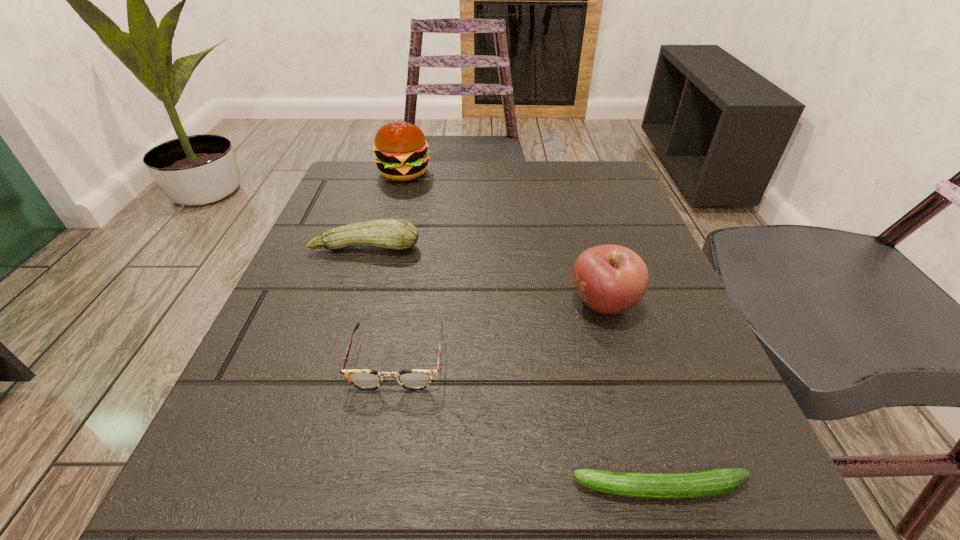
At what (x,y) coordinates should I click in order to perform the action: click on object located in the near edge section of the desktop. Please return your answer as a coordinate pair (x, y). Image resolution: width=960 pixels, height=540 pixels. Looking at the image, I should click on (712, 482).

At what (x,y) coordinates should I click in order to perform the action: click on hamburger present at the left edge. Please return your answer as a coordinate pair (x, y). This screenshot has width=960, height=540. Looking at the image, I should click on (401, 152).

This screenshot has height=540, width=960. I want to click on zucchini at the left edge, so click(x=391, y=233).

Find the location of a particular element. spectacles at the left edge is located at coordinates pos(412,379).

This screenshot has width=960, height=540. Identify the location of apple located in the right edge section of the desktop. (610, 279).

At what (x,y) coordinates should I click in order to perform the action: click on zucchini at the right edge. Please return your answer as a coordinate pair (x, y). Looking at the image, I should click on (712, 482).

You are a GUI agent. You are given a task and a screenshot of the screen. Output one action in this format:
    pyautogui.click(x=<x>, y=<y>)
    Task: Click on the object that is at the far left corner
    
    Given the screenshot: What is the action you would take?
    pyautogui.click(x=401, y=152)

The height and width of the screenshot is (540, 960). In order to click on object at the near right corner in this screenshot , I will do `click(712, 482)`.

Where is `vacant space at the far edge`? Image resolution: width=960 pixels, height=540 pixels. vacant space at the far edge is located at coordinates (538, 170).

Locate an element on the screen. The width and height of the screenshot is (960, 540). vacant position at the near edge of the desktop is located at coordinates (478, 517).